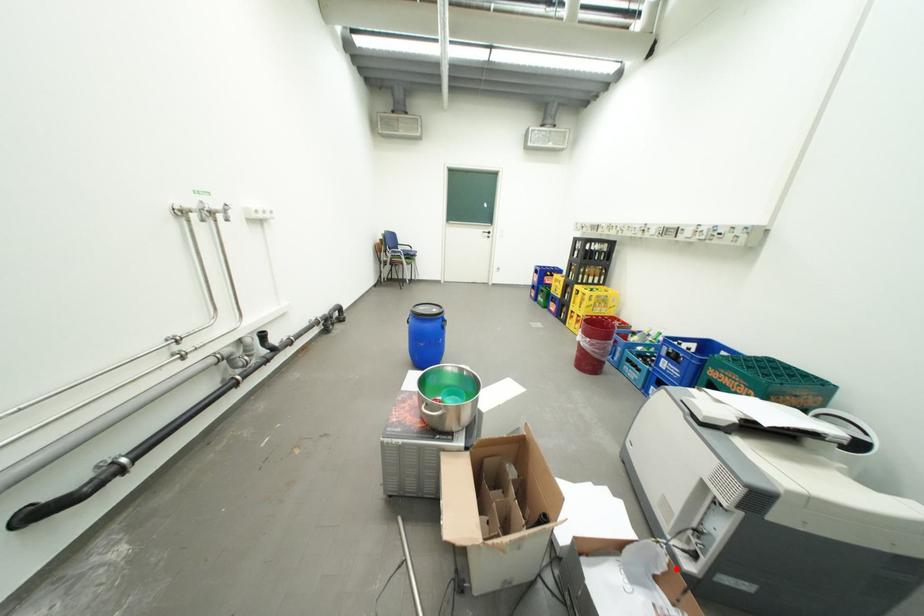
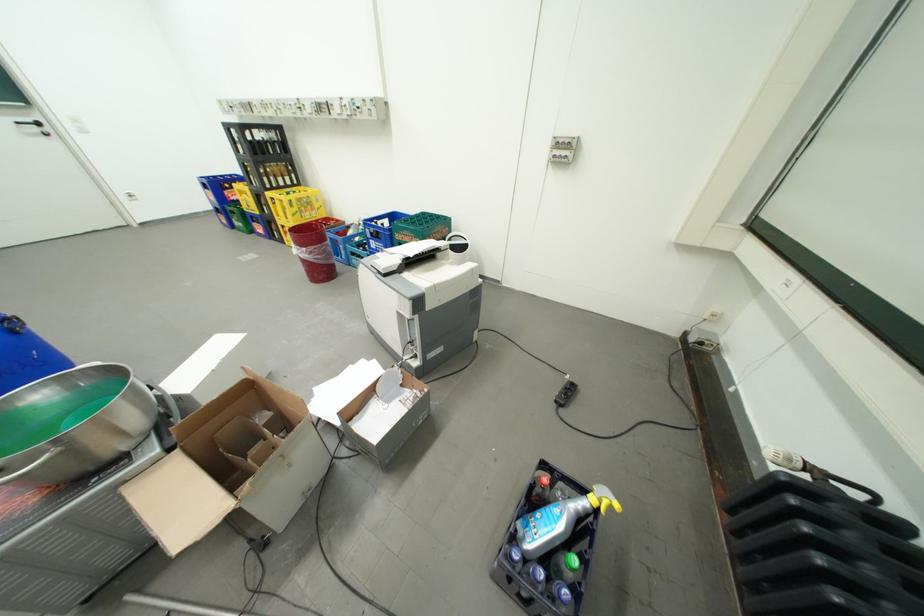
The point at the highlighted location is marked in the first image. Where is the corresponding point in the second image?

(411, 377)